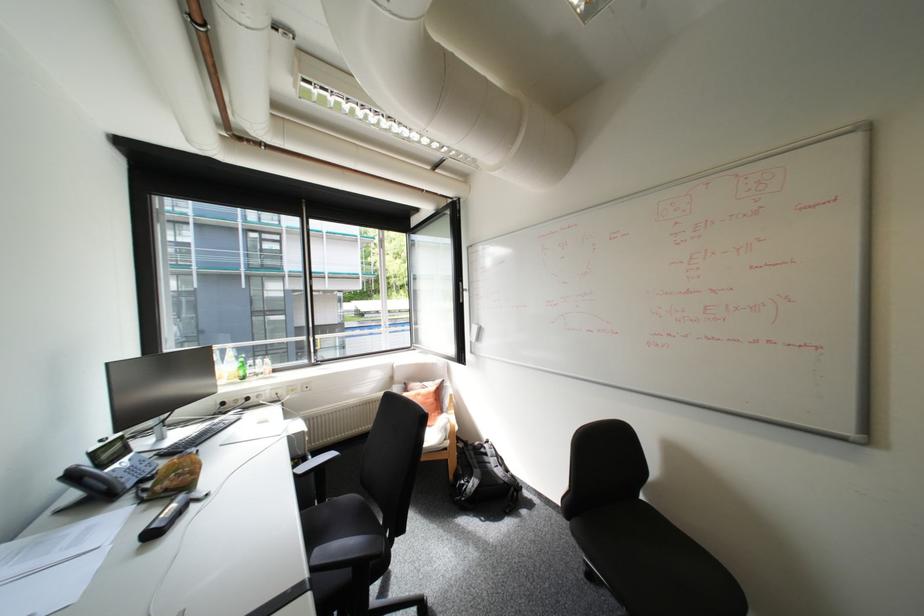
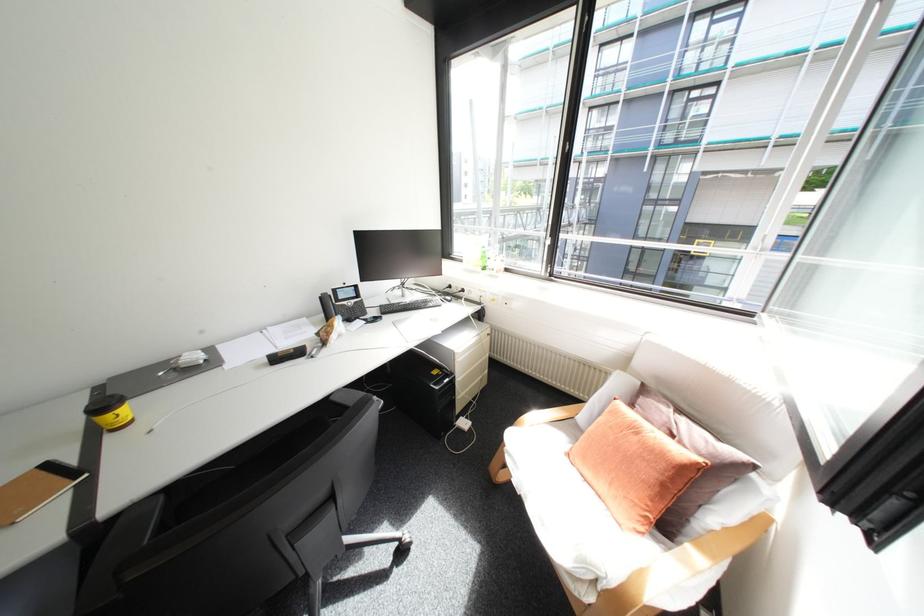
Find the pixel in the second image that matches (x=149, y=544) in the first image.

(275, 361)